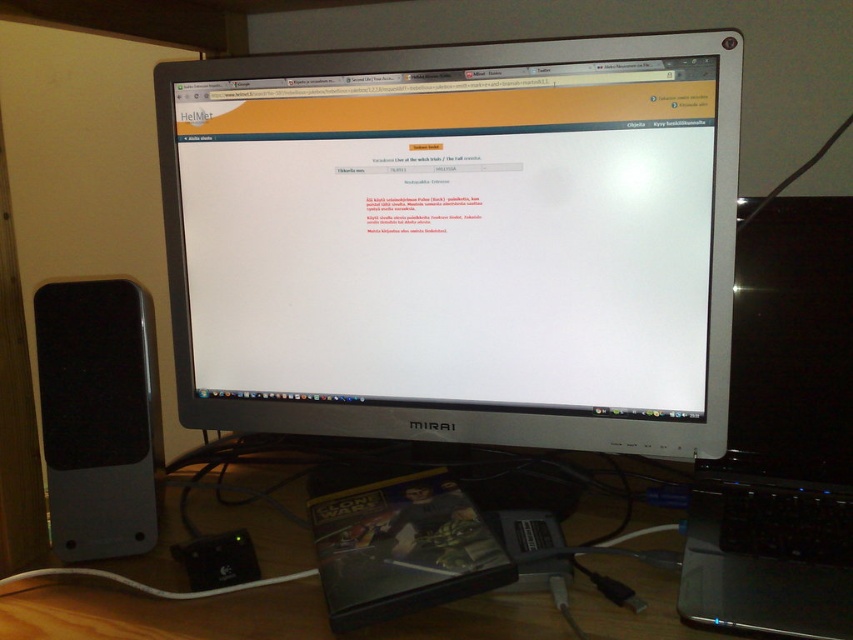
Question: Which object appears closest to the camera in this image?

Choices:
 (A) black matte speaker at left
 (B) silver metallic monitor at center
 (C) black glossy laptop at right

Answer: (C)

Question: Is silver metallic monitor at center positioned behind black matte speaker at left?

Choices:
 (A) no
 (B) yes

Answer: (A)

Question: Which point is closer to the camera taking this photo?

Choices:
 (A) [x=556, y=182]
 (B) [x=144, y=480]

Answer: (A)

Question: Estimate the real-world distances between objects in this image. Which object is closer to the black glossy laptop at right?

Choices:
 (A) wooden at lower left
 (B) black matte speaker at left
 (C) silver metallic monitor at center

Answer: (A)

Question: Does silver metallic monitor at center have a lesser width compared to black glossy laptop at right?

Choices:
 (A) no
 (B) yes

Answer: (A)

Question: Can you confirm if black glossy laptop at right is positioned to the right of wooden at lower left?

Choices:
 (A) no
 (B) yes

Answer: (B)